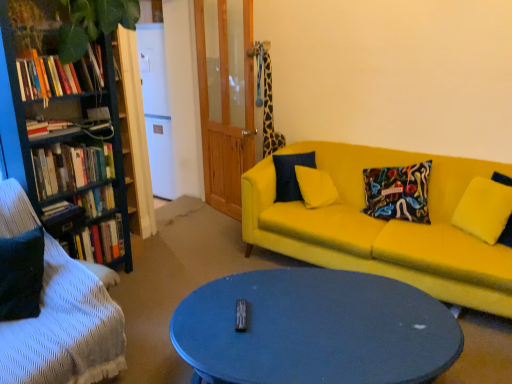
What are the coordinates of `wooden bookshelf at left` in the screenshot? It's located at (65, 130).

The width and height of the screenshot is (512, 384). Describe the element at coordinates (383, 226) in the screenshot. I see `yellow fabric couch at center, the 2th studio couch viewed from the left` at that location.

Where is `yellow fabric pillow at right`? yellow fabric pillow at right is located at coordinates (485, 208).

This screenshot has height=384, width=512. Describe the element at coordinates (70, 167) in the screenshot. I see `hardcover books at left, the third book when ordered from top to bottom` at that location.

This screenshot has height=384, width=512. Describe the element at coordinates (58, 74) in the screenshot. I see `hardcover books at left, placed as the first book when sorted from top to bottom` at that location.

What is the approximate width of hardcover books at left, which is the 2th book in top-to-bottom order?

10.84 inches.

This screenshot has height=384, width=512. In order to click on wooden bookshelf at left in this screenshot , I will do `click(65, 130)`.

Who is more distant, hardcover books at left, acting as the fifth book starting from the bottom, or matte blue coffee table at center?

hardcover books at left, acting as the fifth book starting from the bottom, is behind.

From a real-world perspective, which object rests below the other?

matte blue coffee table at center, from a real-world perspective.

Does hardcover books at left, placed as the first book when sorted from top to bottom, turn towards matte blue coffee table at center?

No, hardcover books at left, placed as the first book when sorted from top to bottom, is not aimed at matte blue coffee table at center.

How many degrees apart are the facing directions of hardcover books at left, acting as the fifth book starting from the bottom, and matte blue coffee table at center?

hardcover books at left, acting as the fifth book starting from the bottom, and matte blue coffee table at center are facing 54.9 degrees away from each other.

Is hardcover book at left, which appears as the fifth book when viewed from the top, facing towards hardcover book at left, the fourth book when ordered from top to bottom?

No.

Who is smaller, hardcover book at left, the 1th book positioned from the bottom, or hardcover book at left, placed as the 2th book when sorted from bottom to top?

With smaller size is hardcover book at left, the 1th book positioned from the bottom.

Is hardcover book at left, which appears as the fifth book when viewed from the top, placed right next to hardcover book at left, the fourth book when ordered from top to bottom?

hardcover book at left, which appears as the fifth book when viewed from the top, and hardcover book at left, the fourth book when ordered from top to bottom, are clearly separated.

Is hardcover books at left, placed as the first book when sorted from top to bottom, in front of or behind velvet black studio couch at lower left, the 1th studio couch when ordered from left to right, in the image?

hardcover books at left, placed as the first book when sorted from top to bottom, is positioned farther from the viewer than velvet black studio couch at lower left, the 1th studio couch when ordered from left to right.

Can you see hardcover books at left, acting as the fifth book starting from the bottom, touching velvet black studio couch at lower left, which is the 2th studio couch from right to left?

hardcover books at left, acting as the fifth book starting from the bottom, and velvet black studio couch at lower left, which is the 2th studio couch from right to left, are not in contact.

Looking at this image, is hardcover books at left, acting as the fifth book starting from the bottom, facing towards velvet black studio couch at lower left, the second studio couch viewed from the back?

No, hardcover books at left, acting as the fifth book starting from the bottom, does not turn towards velvet black studio couch at lower left, the second studio couch viewed from the back.

Is point (89, 74) farther from camera compared to point (7, 236)?

Yes.

Does hardcover book at left, the fourth book when ordered from top to bottom, turn towards velvet black studio couch at lower left, which is the 2th studio couch from right to left?

No, hardcover book at left, the fourth book when ordered from top to bottom, does not turn towards velvet black studio couch at lower left, which is the 2th studio couch from right to left.

From the image's perspective, does hardcover book at left, placed as the 2th book when sorted from bottom to top, appear lower than velvet black studio couch at lower left, the 1th studio couch when ordered from left to right?

No, from the image's perspective, hardcover book at left, placed as the 2th book when sorted from bottom to top, is not beneath velvet black studio couch at lower left, the 1th studio couch when ordered from left to right.

Can velvet black studio couch at lower left, the second studio couch viewed from the back, be found inside hardcover book at left, placed as the 2th book when sorted from bottom to top?

No.

Is hardcover book at left, placed as the 2th book when sorted from bottom to top, taller or shorter than velvet black studio couch at lower left, the second studio couch viewed from the back?

Clearly, hardcover book at left, placed as the 2th book when sorted from bottom to top, is shorter compared to velvet black studio couch at lower left, the second studio couch viewed from the back.

At what (x,y) coordinates should I click in order to perform the action: click on coffee table lying in front of the hardcover books at left, the 3th book ordered from the bottom. Please return your answer as a coordinate pair (x, y). Looking at the image, I should click on pos(314,329).

Considering the positions of objects matte blue coffee table at center and hardcover books at left, the third book when ordered from top to bottom, in the image provided, who is behind, matte blue coffee table at center or hardcover books at left, the third book when ordered from top to bottom,?

hardcover books at left, the third book when ordered from top to bottom, is further away from the camera.

Considering the sizes of objects matte blue coffee table at center and hardcover books at left, the 3th book ordered from the bottom, in the image provided, who is bigger, matte blue coffee table at center or hardcover books at left, the 3th book ordered from the bottom,?

Bigger between the two is matte blue coffee table at center.

Is matte blue coffee table at center next to hardcover books at left, the third book when ordered from top to bottom?

No, matte blue coffee table at center is not in contact with hardcover books at left, the third book when ordered from top to bottom.

Locate an element on the screen. This screenshot has width=512, height=384. book that is the 5th one above the velvet black studio couch at lower left, which is the 2th studio couch from right to left (from a real-world perspective) is located at coordinates (58, 74).

Is velvet black studio couch at lower left, the second studio couch viewed from the back, to the right of hardcover books at left, placed as the first book when sorted from top to bottom, from the viewer's perspective?

Incorrect, velvet black studio couch at lower left, the second studio couch viewed from the back, is not on the right side of hardcover books at left, placed as the first book when sorted from top to bottom.

From a real-world perspective, between velvet black studio couch at lower left, which is the 2th studio couch from right to left, and hardcover books at left, placed as the first book when sorted from top to bottom, who is vertically higher?

hardcover books at left, placed as the first book when sorted from top to bottom.

Which of these two, velvet black studio couch at lower left, which is the 2th studio couch from right to left, or hardcover books at left, acting as the fifth book starting from the bottom, stands shorter?

hardcover books at left, acting as the fifth book starting from the bottom.

Is velvet black studio couch at lower left, placed as the 1th studio couch when sorted from front to back, turned away from hardcover book at left, the 1th book positioned from the bottom?

Yes.

From the image's perspective, does velvet black studio couch at lower left, placed as the 1th studio couch when sorted from front to back, appear higher than hardcover book at left, which appears as the fifth book when viewed from the top?

No, from the image's perspective, velvet black studio couch at lower left, placed as the 1th studio couch when sorted from front to back, is not on top of hardcover book at left, which appears as the fifth book when viewed from the top.

Is velvet black studio couch at lower left, placed as the 1th studio couch when sorted from front to back, thinner than hardcover book at left, the 1th book positioned from the bottom?

In fact, velvet black studio couch at lower left, placed as the 1th studio couch when sorted from front to back, might be wider than hardcover book at left, the 1th book positioned from the bottom.

Is velvet black studio couch at lower left, the second studio couch viewed from the back, surrounding hardcover book at left, which appears as the fifth book when viewed from the top?

No, hardcover book at left, which appears as the fifth book when viewed from the top, is located outside of velvet black studio couch at lower left, the second studio couch viewed from the back.

I want to click on coffee table that is below the hardcover books at left, acting as the fifth book starting from the bottom (from the image's perspective), so [x=314, y=329].

Where is `book that is the 4th object to the left of the hardcover book at left, the fourth book when ordered from top to bottom, starting at the anchor`? The image size is (512, 384). book that is the 4th object to the left of the hardcover book at left, the fourth book when ordered from top to bottom, starting at the anchor is located at coordinates (58, 210).

When comparing their distances from hardcover book at left, the 1th book positioned from the bottom, does hardcover books at left, which is the 2th book in top-to-bottom order, or hardcover book at left, placed as the 2th book when sorted from bottom to top, seem closer?

hardcover book at left, placed as the 2th book when sorted from bottom to top, lies closer to hardcover book at left, the 1th book positioned from the bottom, than the other object.

Which object lies nearer to the anchor point velvet black studio couch at lower left, the second studio couch viewed from the back, hardcover book at left, placed as the 2th book when sorted from bottom to top, or wooden bookshelf at left?

wooden bookshelf at left is positioned closer to the anchor velvet black studio couch at lower left, the second studio couch viewed from the back.

Which object lies nearer to the anchor point velvet black studio couch at lower left, the second studio couch viewed from the back, yellow fabric couch at center, which is the 1th studio couch from right to left, or hardcover books at left, the 3th book ordered from the bottom?

hardcover books at left, the 3th book ordered from the bottom.

When comparing their distances from hardcover book at left, the 1th book positioned from the bottom, does hardcover books at left, acting as the fifth book starting from the bottom, or wooden bookshelf at left seem closer?

wooden bookshelf at left.

From the image, which object appears to be nearer to hardcover book at left, the fourth book when ordered from top to bottom, yellow fabric couch at center, the 2th studio couch viewed from the left, or hardcover books at left, placed as the first book when sorted from top to bottom?

hardcover books at left, placed as the first book when sorted from top to bottom, is positioned closer to the anchor hardcover book at left, the fourth book when ordered from top to bottom.

Looking at the image, which one is located further to matte blue coffee table at center, hardcover book at left, the 1th book positioned from the bottom, or hardcover books at left, the third book when ordered from top to bottom?

Among the two, hardcover book at left, the 1th book positioned from the bottom, is located further to matte blue coffee table at center.

When comparing their distances from yellow fabric couch at center, the 2th studio couch viewed from the left, does hardcover books at left, acting as the fifth book starting from the bottom, or matte blue coffee table at center seem further?

hardcover books at left, acting as the fifth book starting from the bottom, lies further to yellow fabric couch at center, the 2th studio couch viewed from the left, than the other object.

From the image, which object appears to be farther from hardcover book at left, placed as the 2th book when sorted from bottom to top, hardcover books at left, placed as the first book when sorted from top to bottom, or velvet black studio couch at lower left, the 1th studio couch when ordered from left to right?

hardcover books at left, placed as the first book when sorted from top to bottom, is further to hardcover book at left, placed as the 2th book when sorted from bottom to top.

Where is `studio couch between wooden bookshelf at left and yellow fabric couch at center, which is the second studio couch from front to back, from left to right`? The width and height of the screenshot is (512, 384). studio couch between wooden bookshelf at left and yellow fabric couch at center, which is the second studio couch from front to back, from left to right is located at coordinates (65, 329).

The image size is (512, 384). What are the coordinates of `coffee table between hardcover book at left, placed as the 2th book when sorted from bottom to top, and yellow fabric pillow at right, in the horizontal direction` in the screenshot? It's located at tap(314, 329).

Image resolution: width=512 pixels, height=384 pixels. Identify the location of studio couch situated between hardcover book at left, the fourth book when ordered from top to bottom, and yellow fabric pillow at right from left to right. (383, 226).

Find the location of a particular element. coffee table between hardcover book at left, the 1th book positioned from the bottom, and yellow fabric couch at center, which is counted as the first studio couch, starting from the back, from left to right is located at coordinates (314, 329).